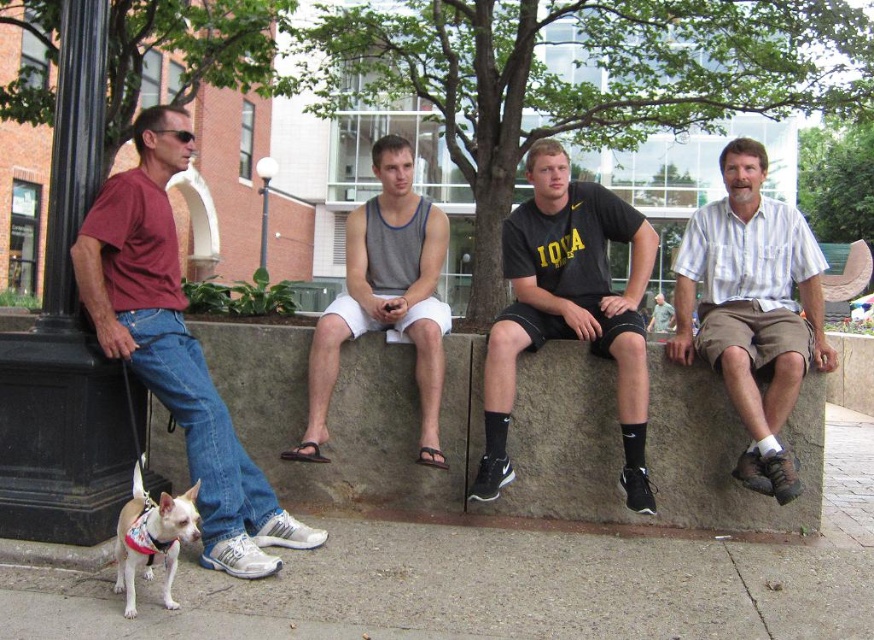
Is point (371, 280) positioned in front of point (153, 513)?

That is False.

Consider the image. Does gray tank top at center appear under white fur dog at lower left?

No.

Which is in front, point (364, 224) or point (146, 497)?

Positioned in front is point (146, 497).

You are a GUI agent. You are given a task and a screenshot of the screen. Output one action in this format:
    pyautogui.click(x=<x>, y=<y>)
    Task: Click on the gray tank top at center
    This screenshot has width=874, height=640.
    Given the screenshot: What is the action you would take?
    pyautogui.click(x=385, y=296)

At what (x,y) coordinates should I click in order to perform the action: click on gray concrete at lower left. Please return your answer as a coordinate pair (x, y). Image resolution: width=874 pixels, height=640 pixels. Looking at the image, I should click on (484, 589).

Which is below, gray concrete at lower left or gray tank top at center?

Positioned lower is gray concrete at lower left.

This screenshot has height=640, width=874. Describe the element at coordinates (484, 589) in the screenshot. I see `gray concrete at lower left` at that location.

Locate an element on the screen. This screenshot has width=874, height=640. gray concrete at lower left is located at coordinates (484, 589).

The height and width of the screenshot is (640, 874). I want to click on gray concrete bench at center, so click(x=510, y=435).

Does point (380, 348) lie in front of point (515, 374)?

No.

Identify the location of gray concrete bench at center. This screenshot has height=640, width=874. (510, 435).